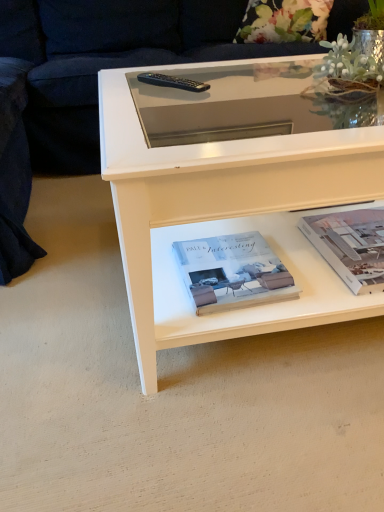
Question: Considering the positions of dark blue fabric couch at upper left and white matte book at center, the first paperback book positioned from the left, in the image, is dark blue fabric couch at upper left taller or shorter than white matte book at center, the first paperback book positioned from the left,?

Choices:
 (A) short
 (B) tall

Answer: (B)

Question: From a real-world perspective, relative to white matte book at center, the first paperback book positioned from the left, is dark blue fabric couch at upper left vertically above or below?

Choices:
 (A) above
 (B) below

Answer: (A)

Question: Which object is the closest to the white paper at lower right, positioned as the first paperback book in right-to-left order?

Choices:
 (A) black plastic remote at upper center
 (B) white matte book at center, the first paperback book positioned from the left
 (C) floral fabric pillow at upper center
 (D) dark blue fabric couch at upper left

Answer: (B)

Question: Which object is positioned closest to the white paper at lower right, which ranks as the second paperback book in left-to-right order?

Choices:
 (A) dark blue fabric couch at upper left
 (B) white matte book at center, the 2th paperback book viewed from the right
 (C) floral fabric pillow at upper center
 (D) black plastic remote at upper center

Answer: (B)